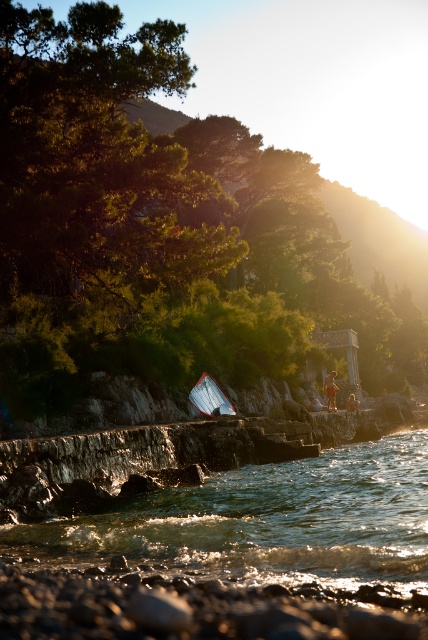
Question: Can you confirm if smooth pebbles at lower center is thinner than tan fabric shorts at lower right?

Choices:
 (A) yes
 (B) no

Answer: (B)

Question: Can you confirm if smooth pebbles at lower center is positioned above white plastic boat at center?

Choices:
 (A) yes
 (B) no

Answer: (A)

Question: Which point appears farthest from the camera in this image?

Choices:
 (A) (210, 416)
 (B) (350, 403)

Answer: (B)

Question: Which object appears farthest from the camera in this image?

Choices:
 (A) tan fabric shorts at lower right
 (B) smooth pebbles at lower center
 (C) white plastic boat at center

Answer: (A)

Question: Is clear water at lower center positioned behind white plastic boat at center?

Choices:
 (A) yes
 (B) no

Answer: (B)

Question: Which is farther from the brown leather jacket at center?

Choices:
 (A) white plastic boat at center
 (B) tan fabric shorts at lower right

Answer: (A)